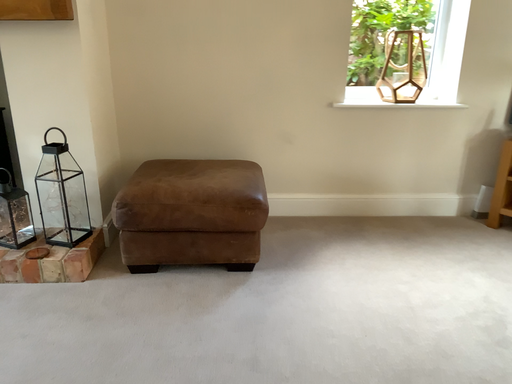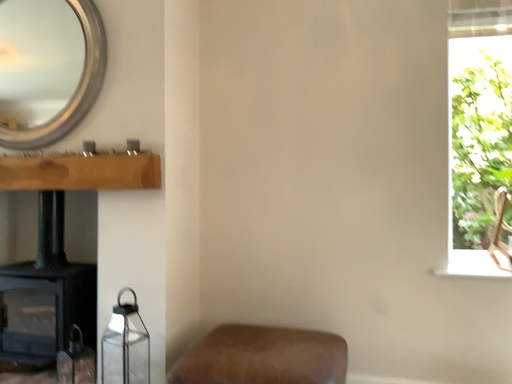
Question: How did the camera likely rotate when shooting the video?

Choices:
 (A) rotated right
 (B) rotated left

Answer: (B)